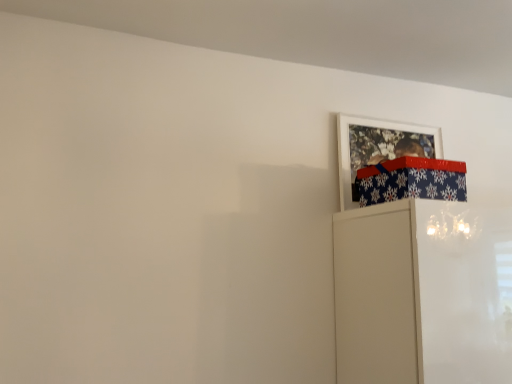
Question: Can blue snowflake-patterned wrapping paper at upper right be found inside white matte picture frame at upper right?

Choices:
 (A) no
 (B) yes

Answer: (A)

Question: Considering the relative sizes of white matte picture frame at upper right and blue snowflake-patterned wrapping paper at upper right in the image provided, is white matte picture frame at upper right smaller than blue snowflake-patterned wrapping paper at upper right?

Choices:
 (A) yes
 (B) no

Answer: (A)

Question: Considering the relative positions of white matte picture frame at upper right and blue snowflake-patterned wrapping paper at upper right in the image provided, is white matte picture frame at upper right to the right of blue snowflake-patterned wrapping paper at upper right from the viewer's perspective?

Choices:
 (A) yes
 (B) no

Answer: (A)

Question: Considering the relative sizes of white matte picture frame at upper right and blue snowflake-patterned wrapping paper at upper right in the image provided, is white matte picture frame at upper right shorter than blue snowflake-patterned wrapping paper at upper right?

Choices:
 (A) yes
 (B) no

Answer: (B)

Question: From the image's perspective, is white matte picture frame at upper right under blue snowflake-patterned wrapping paper at upper right?

Choices:
 (A) yes
 (B) no

Answer: (B)

Question: Considering the relative positions of white matte picture frame at upper right and blue snowflake-patterned wrapping paper at upper right in the image provided, is white matte picture frame at upper right to the left of blue snowflake-patterned wrapping paper at upper right from the viewer's perspective?

Choices:
 (A) no
 (B) yes

Answer: (A)

Question: From the image's perspective, does blue snowflake-patterned wrapping paper at upper right appear higher than white matte picture frame at upper right?

Choices:
 (A) yes
 (B) no

Answer: (B)

Question: Is blue snowflake-patterned wrapping paper at upper right outside white matte picture frame at upper right?

Choices:
 (A) no
 (B) yes

Answer: (B)

Question: From the image's perspective, does blue snowflake-patterned wrapping paper at upper right appear lower than white matte picture frame at upper right?

Choices:
 (A) no
 (B) yes

Answer: (B)

Question: Can you confirm if blue snowflake-patterned wrapping paper at upper right is shorter than white matte picture frame at upper right?

Choices:
 (A) yes
 (B) no

Answer: (A)

Question: Can you confirm if blue snowflake-patterned wrapping paper at upper right is positioned to the left of white matte picture frame at upper right?

Choices:
 (A) yes
 (B) no

Answer: (A)

Question: Does blue snowflake-patterned wrapping paper at upper right have a lesser width compared to white matte picture frame at upper right?

Choices:
 (A) no
 (B) yes

Answer: (A)

Question: Based on their sizes in the image, would you say blue snowflake-patterned wrapping paper at upper right is bigger or smaller than white matte picture frame at upper right?

Choices:
 (A) small
 (B) big

Answer: (B)